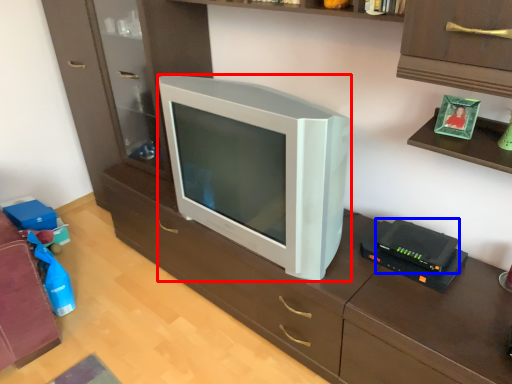
Question: Among these objects, which one is nearest to the camera, television (highlighted by a red box) or gadget (highlighted by a blue box)?

Choices:
 (A) television
 (B) gadget

Answer: (A)